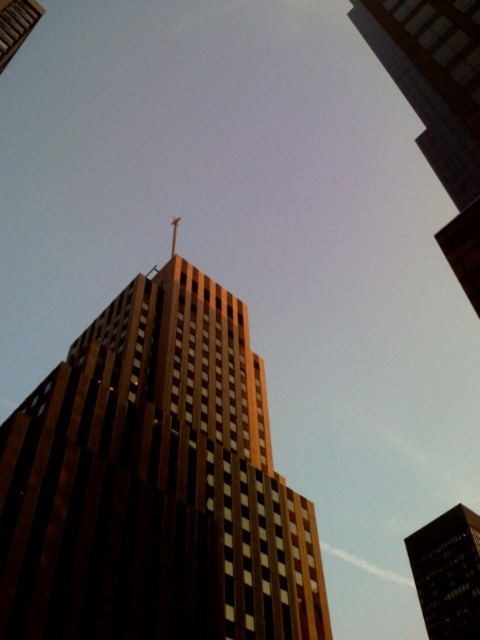
Question: In this image, where is brown textured building at center located relative to shiny gold spire at top?

Choices:
 (A) below
 (B) above

Answer: (A)

Question: Is brown textured building at center to the left of shiny gold spire at top from the viewer's perspective?

Choices:
 (A) yes
 (B) no

Answer: (B)

Question: Among these points, which one is farthest from the camera?

Choices:
 (A) (172, 234)
 (B) (109, 403)

Answer: (A)

Question: Among these points, which one is farthest from the camera?

Choices:
 (A) (170, 246)
 (B) (193, 576)
 (C) (432, 579)

Answer: (A)

Question: Which point is farther to the camera?

Choices:
 (A) (175, 230)
 (B) (448, 621)
 (C) (244, 333)

Answer: (A)

Question: Is brown glass building at upper center behind shiny gold spire at top?

Choices:
 (A) no
 (B) yes

Answer: (B)